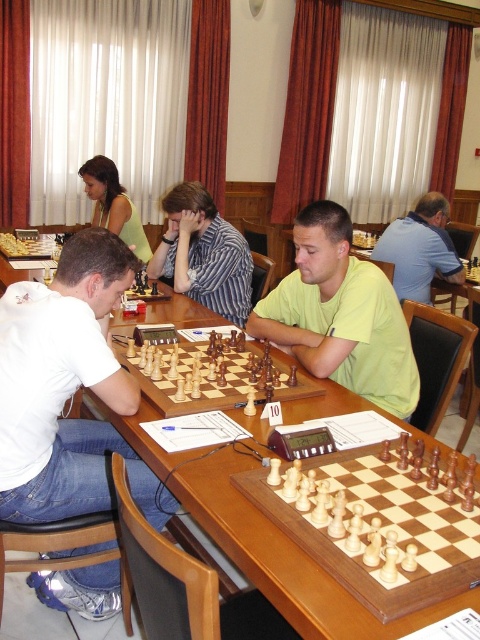
This screenshot has height=640, width=480. What are the coordinates of `wooden chessboard at center` in the screenshot? It's located at (252, 541).

Does wooden chessboard at center have a smaller size compared to blue striped shirt at upper right?

No, wooden chessboard at center is not smaller than blue striped shirt at upper right.

Where is `wooden chessboard at center`? This screenshot has width=480, height=640. wooden chessboard at center is located at coordinates (252, 541).

Is wooden chessboard at center further to camera compared to striped shirt at center?

No, it is not.

In order to click on wooden chessboard at center in this screenshot , I will do `click(252, 541)`.

You are a GUI agent. You are given a task and a screenshot of the screen. Output one action in this format:
    pyautogui.click(x=<x>, y=<y>)
    Task: Click on the light green shirt at center
    Image resolution: width=480 pixels, height=640 pixels.
    Given the screenshot: What is the action you would take?
    pyautogui.click(x=339, y=314)

Can you confirm if light green shirt at center is positioned below wooden chessboard at center?

No.

Which is behind, point (361, 346) or point (274, 560)?

Positioned behind is point (361, 346).

This screenshot has height=640, width=480. I want to click on light green shirt at center, so click(x=339, y=314).